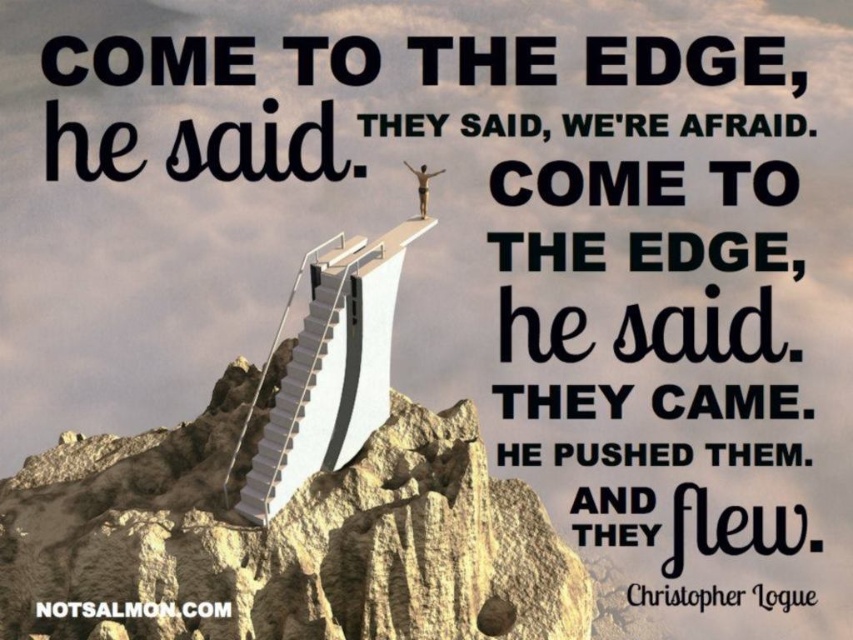
Is white glossy stairs at center smaller than skinny human figure at upper center?

Indeed, white glossy stairs at center has a smaller size compared to skinny human figure at upper center.

Does point (252, 484) come farther from viewer compared to point (425, 208)?

No, it is not.

You are a GUI agent. You are given a task and a screenshot of the screen. Output one action in this format:
    pyautogui.click(x=<x>, y=<y>)
    Task: Click on the white glossy stairs at center
    This screenshot has height=640, width=853.
    Given the screenshot: What is the action you would take?
    pyautogui.click(x=300, y=406)

Between rugged stone peak at center and skinny human figure at upper center, which one has more height?

With more height is rugged stone peak at center.

Who is more distant from viewer, (577, 598) or (418, 170)?

Positioned behind is point (418, 170).

Who is more distant from viewer, (207, 461) or (421, 168)?

The point (421, 168) is more distant.

Locate an element on the screen. The image size is (853, 640). rugged stone peak at center is located at coordinates (283, 540).

Does rugged stone peak at center have a lesser height compared to white glossy stairs at center?

Incorrect, rugged stone peak at center's height does not fall short of white glossy stairs at center's.

Does rugged stone peak at center appear on the right side of white glossy stairs at center?

In fact, rugged stone peak at center is to the left of white glossy stairs at center.

Does point (289, 589) lie behind point (271, 484)?

No, it is not.

Locate an element on the screen. Image resolution: width=853 pixels, height=640 pixels. rugged stone peak at center is located at coordinates (283, 540).